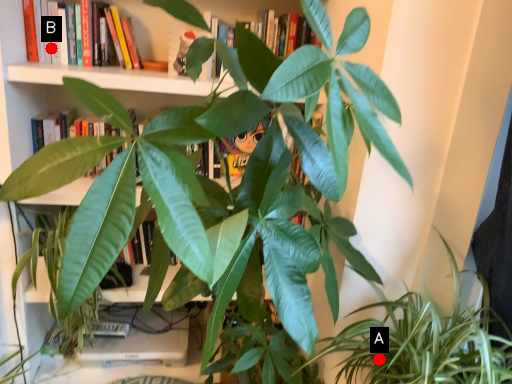
Question: Two points are circled on the image, labeled by A and B beside each circle. Which point is further to the camera?

Choices:
 (A) A is further
 (B) B is further

Answer: (B)